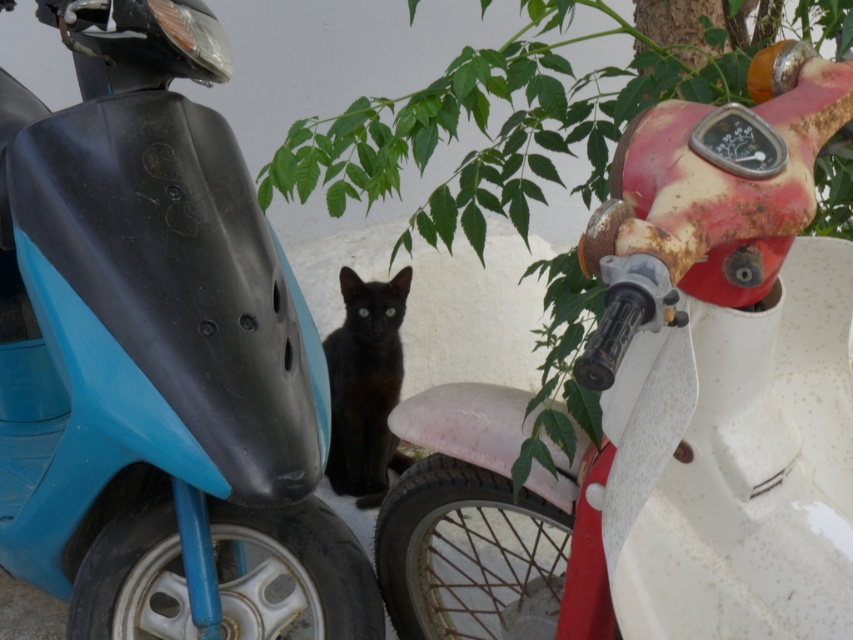
This screenshot has width=853, height=640. What do you see at coordinates (662, 406) in the screenshot? I see `rusty white motorcycle at right` at bounding box center [662, 406].

In order to click on rusty white motorcycle at right in this screenshot , I will do `click(662, 406)`.

Find the location of a particular element. rusty white motorcycle at right is located at coordinates (662, 406).

Which is more to the left, rusty white motorcycle at right or black glossy cat at center?

black glossy cat at center is more to the left.

Does point (711, 582) come behind point (349, 385)?

No, (711, 582) is in front of (349, 385).

You are a GUI agent. You are given a task and a screenshot of the screen. Output one action in this format:
    pyautogui.click(x=<x>, y=<y>)
    Task: Click on the rusty white motorcycle at right
    This screenshot has width=853, height=640.
    Given the screenshot: What is the action you would take?
    pyautogui.click(x=662, y=406)

Between matte black scooter at center and black glossy cat at center, which one appears on the right side from the viewer's perspective?

black glossy cat at center

Can you confirm if matte black scooter at center is positioned to the right of black glossy cat at center?

A: No, matte black scooter at center is not to the right of black glossy cat at center.

Is point (370, 627) more distant than point (344, 269)?

No.

Where is `matte black scooter at center`? This screenshot has width=853, height=640. matte black scooter at center is located at coordinates (158, 356).